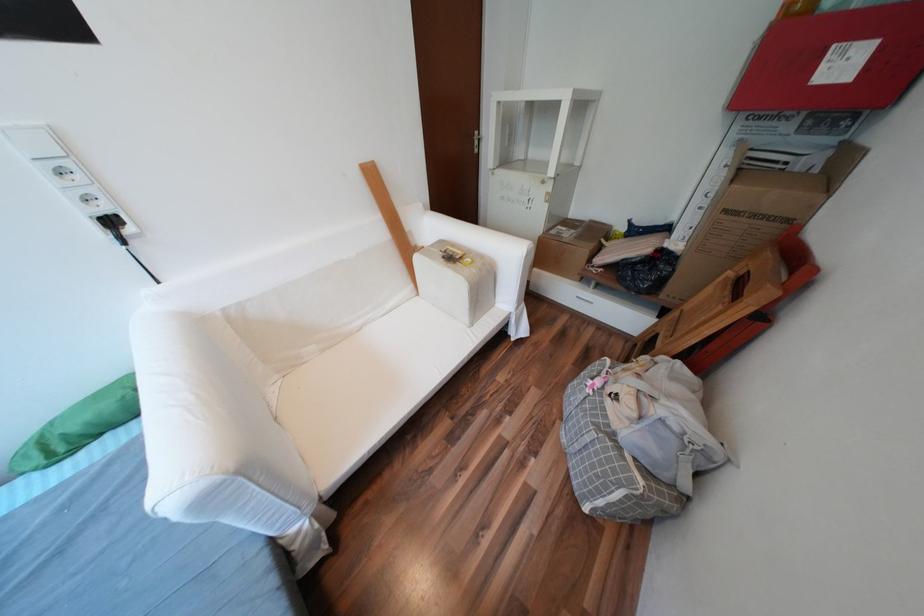
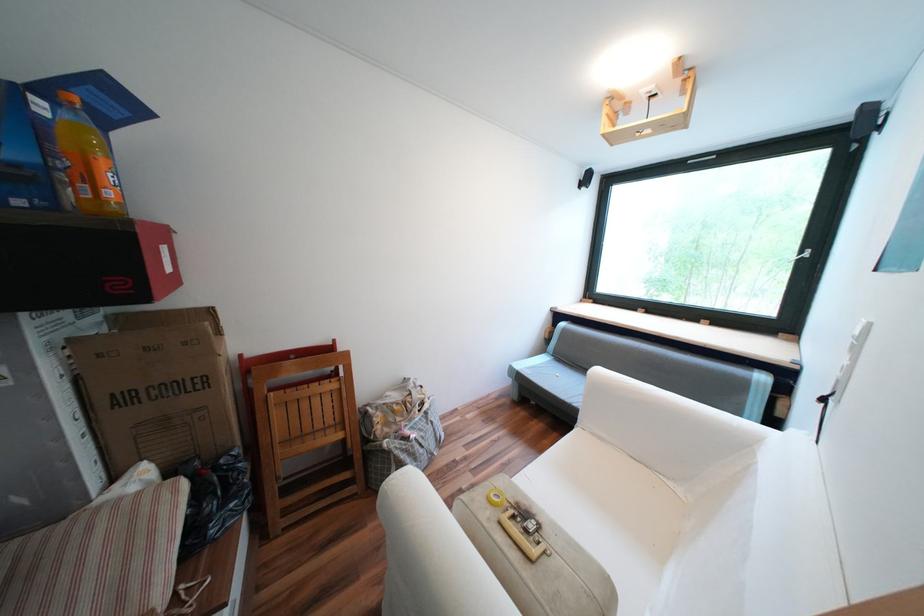
The point at (736, 292) is marked in the first image. Where is the corresponding point in the second image?

(325, 383)